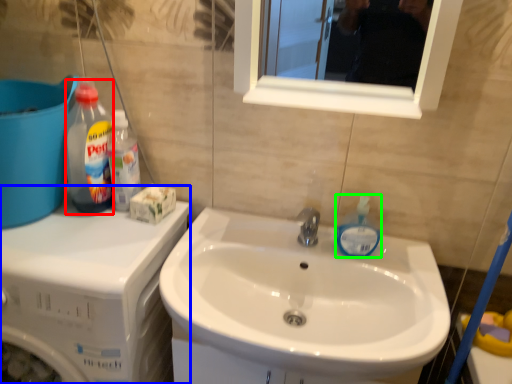
Question: Which object is positioned closest to cleaning product (highlighted by a red box)? Select from dish washer (highlighted by a blue box) and cleaning product (highlighted by a green box).

Choices:
 (A) dish washer
 (B) cleaning product

Answer: (A)